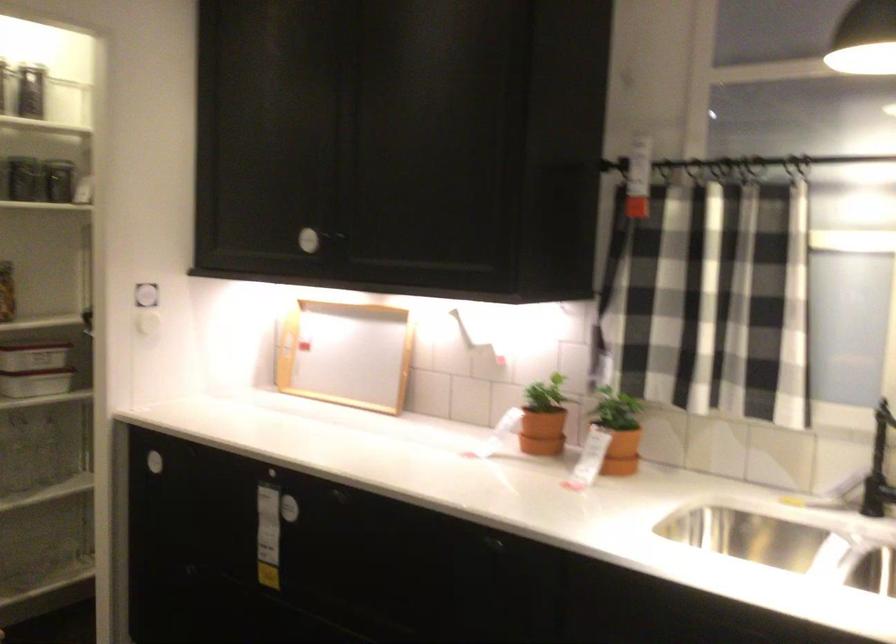
Describe the element at coordinates (879, 468) in the screenshot. I see `the black faucet handle` at that location.